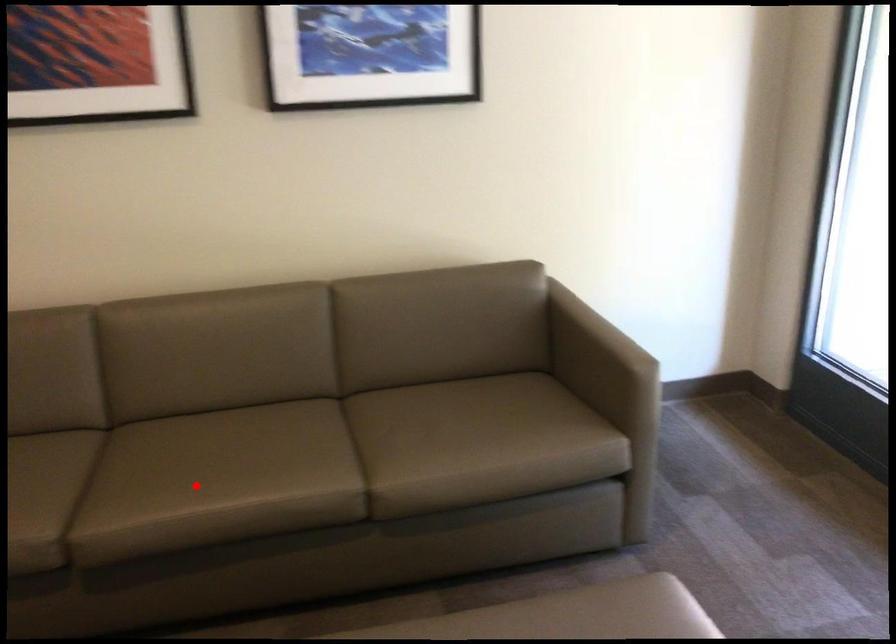
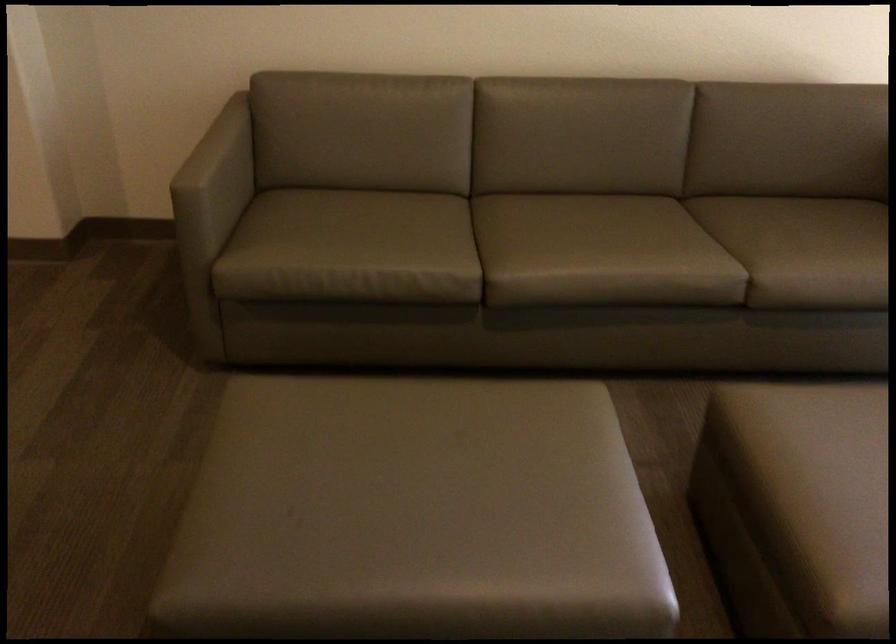
In the second image, find the point that corresponds to the highlighted location in the first image.

(583, 247)